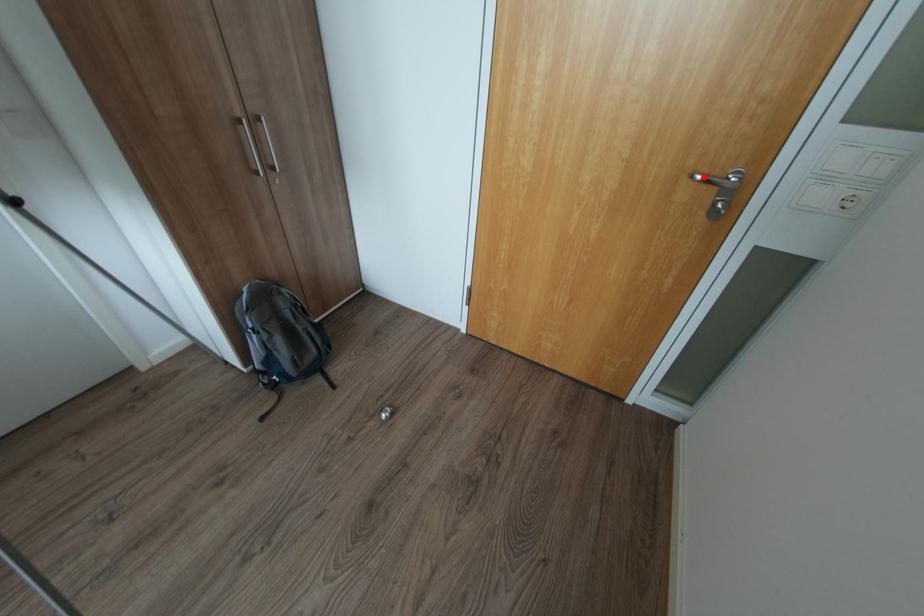
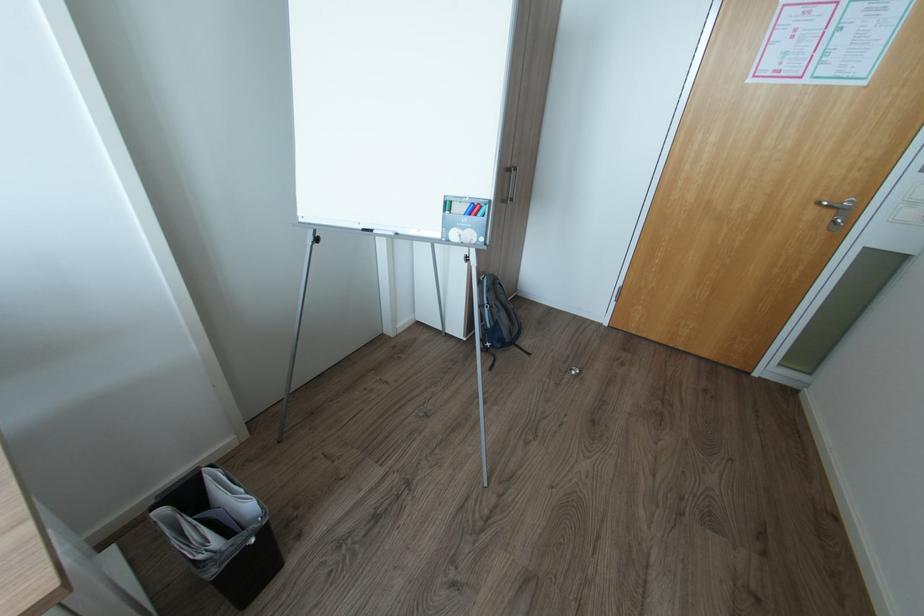
Question: A red point is marked in image1. In image2, is the corresponding 3D point closer to the camera or farther? Reply with the corresponding letter.

Choices:
 (A) The corresponding 3D point is closer.
 (B) The corresponding 3D point is farther.

Answer: (B)